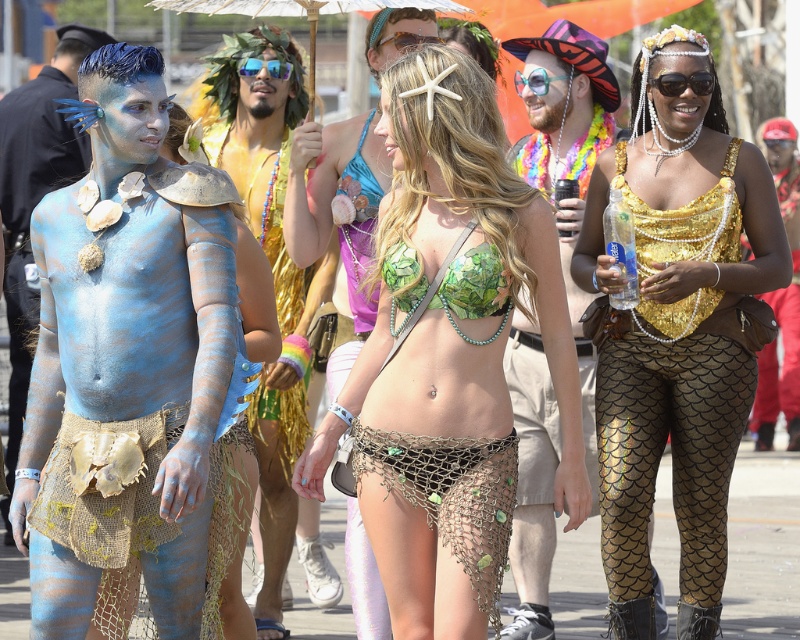
Question: Can you confirm if white paper umbrella at upper center is smaller than black plastic sunglasses at upper right?

Choices:
 (A) no
 (B) yes

Answer: (A)

Question: Which point is closer to the camera?

Choices:
 (A) (740, 364)
 (B) (704, 92)
 (C) (428, 198)

Answer: (C)

Question: Which point is farther from the camera taking this photo?

Choices:
 (A) (548, 321)
 (B) (278, 60)
 (C) (636, 429)
 (D) (384, 3)

Answer: (B)

Question: Is the position of green leafy fabric bikini top at center more distant than that of black plastic sunglasses at upper right?

Choices:
 (A) no
 (B) yes

Answer: (A)

Question: Among these objects, which one is farthest from the camera?

Choices:
 (A) black plastic sunglasses at upper right
 (B) blue reflective sunglasses at center
 (C) gold sequined top at center

Answer: (B)

Question: Is green leafy fabric bikini top at center further to the viewer compared to white paper umbrella at upper center?

Choices:
 (A) yes
 (B) no

Answer: (B)